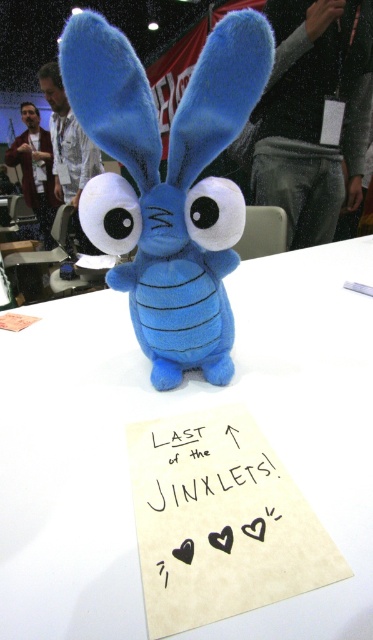
Can you confirm if white matte table at center is positioned above black paper at center?

Yes, white matte table at center is above black paper at center.

Between point (86, 422) and point (252, 529), which one is positioned behind?

Point (86, 422)

Does point (346, 588) come behind point (164, 472)?

That is False.

Where is `white matte table at center`? white matte table at center is located at coordinates (171, 413).

Between matte blue plush toy at center and black paper at center, which one has more height?

matte blue plush toy at center

Looking at this image, does matte blue plush toy at center lie behind black paper at center?

Yes, it is.

Is point (202, 204) positioned after point (140, 524)?

Yes, point (202, 204) is behind point (140, 524).

Find the location of `matte blue plush toy at center`. matte blue plush toy at center is located at coordinates (167, 180).

Between white matte table at center and matte blue plush toy at center, which one has more height?

white matte table at center

Who is positioned more to the left, white matte table at center or matte blue plush toy at center?

Positioned to the left is matte blue plush toy at center.

What do you see at coordinates (171, 413) in the screenshot? The height and width of the screenshot is (640, 373). I see `white matte table at center` at bounding box center [171, 413].

The width and height of the screenshot is (373, 640). I want to click on white matte table at center, so click(171, 413).